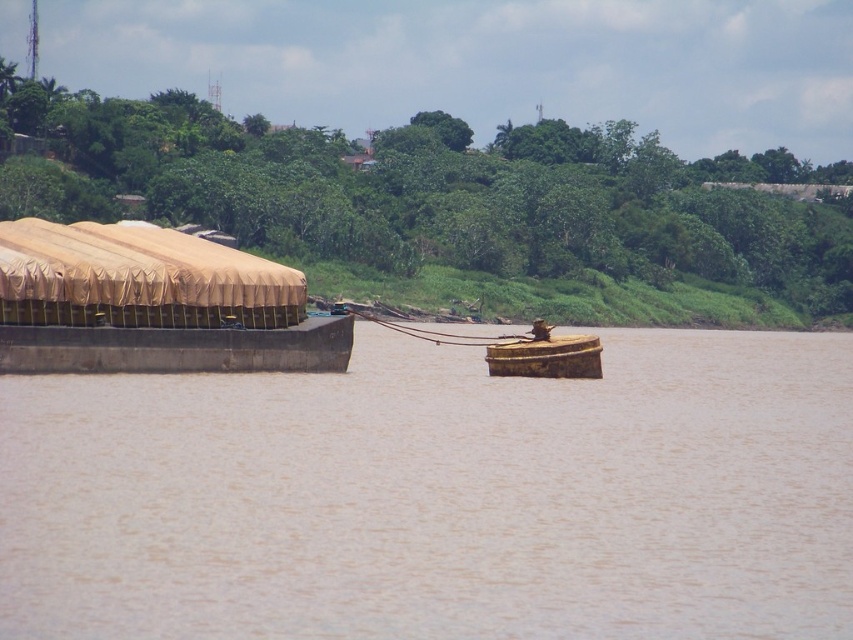
Question: Which point appears farthest from the camera in this image?

Choices:
 (A) (7, 339)
 (B) (479, 588)

Answer: (A)

Question: Considering the relative positions of brown matte barge at left and tan canvas boat at left in the image provided, where is brown matte barge at left located with respect to tan canvas boat at left?

Choices:
 (A) right
 (B) left

Answer: (A)

Question: Does brown matte barge at left have a greater width compared to tan canvas boat at left?

Choices:
 (A) no
 (B) yes

Answer: (B)

Question: Which of the following is the closest to the observer?

Choices:
 (A) brown matte barge at left
 (B) tan canvas boat at left

Answer: (A)

Question: Is brown matte barge at left wider than tan canvas boat at left?

Choices:
 (A) yes
 (B) no

Answer: (A)